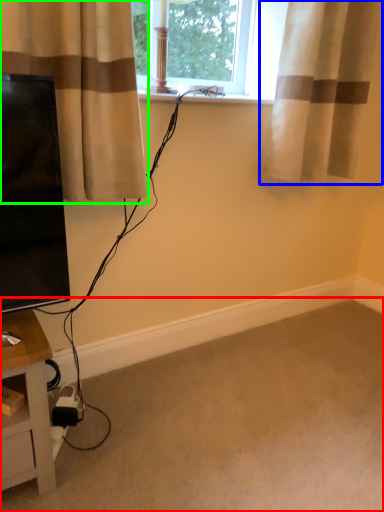
Question: Considering the real-world distances, which object is farthest from plain (highlighted by a red box)? curtain (highlighted by a blue box) or curtain (highlighted by a green box)?

Choices:
 (A) curtain
 (B) curtain

Answer: (A)